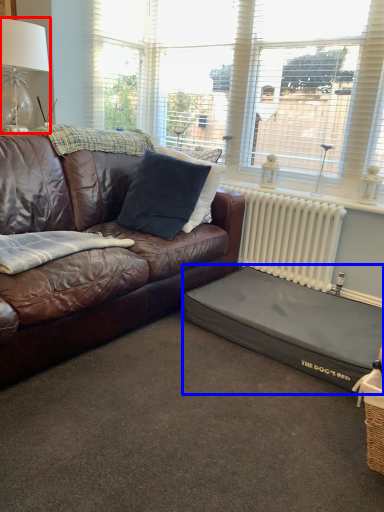
Question: Among these objects, which one is nearest to the camera, table lamp (highlighted by a red box) or footrest (highlighted by a blue box)?

Choices:
 (A) table lamp
 (B) footrest

Answer: (B)